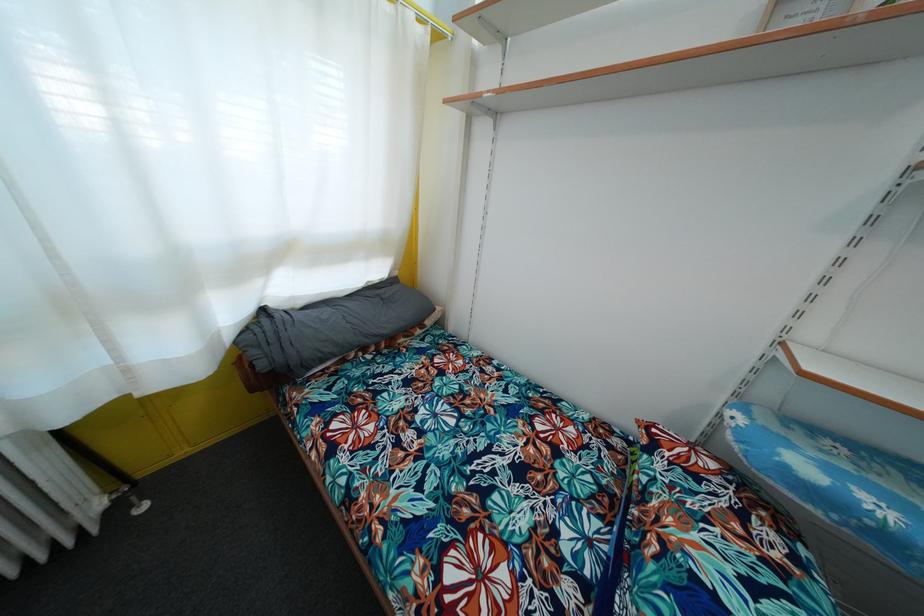
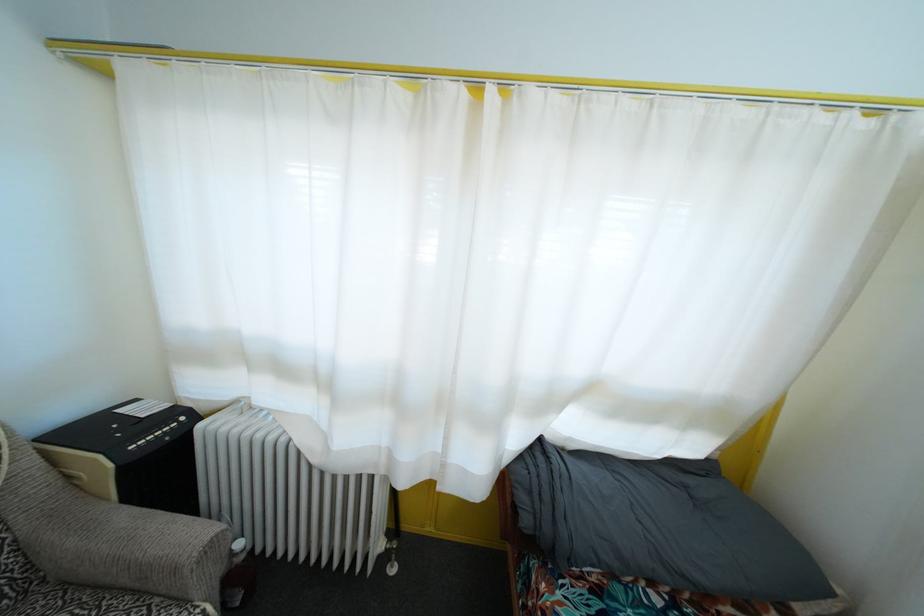
Find the pixel in the second image that matches [58,262] in the first image.

(457, 379)